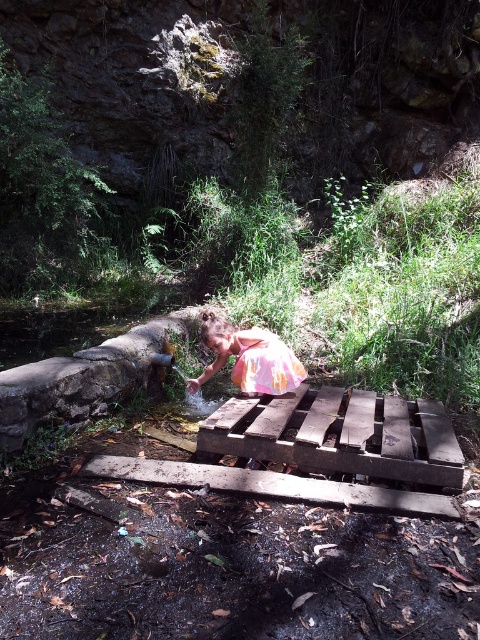
From the picture: Is wooden plank at center closer to camera compared to pastel floral dress at center?

That is True.

Between point (439, 493) and point (256, 348), which one is positioned behind?

The point (256, 348) is more distant.

Where is `wooden plank at center`? This screenshot has width=480, height=640. wooden plank at center is located at coordinates (273, 484).

Does point (233, 403) lie behind point (344, 483)?

That is True.

Does point (289, 456) come closer to viewer compared to point (120, 458)?

Yes, it is.

At what (x,y) coordinates should I click in order to perform the action: click on weathered brown wood at center. Please return your answer as a coordinate pair (x, y). This screenshot has height=640, width=480. Looking at the image, I should click on (339, 435).

Locate an element on the screen. The width and height of the screenshot is (480, 640). weathered brown wood at center is located at coordinates (339, 435).

Is point (429, 420) positioned in front of point (298, 371)?

Yes, point (429, 420) is closer to viewer.

Where is `weathered brown wood at center`? The height and width of the screenshot is (640, 480). weathered brown wood at center is located at coordinates (339, 435).